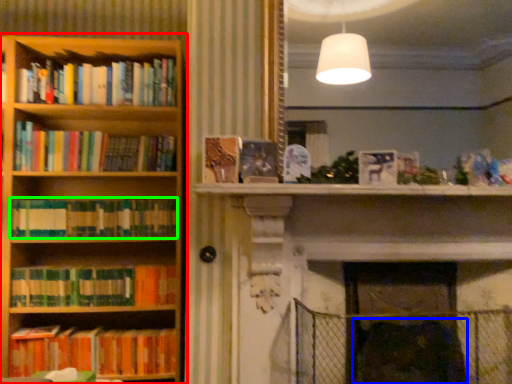
Question: Which is nearer to the bookcase (highlighted by a red box)? swivel chair (highlighted by a blue box) or book (highlighted by a green box).

Choices:
 (A) swivel chair
 (B) book

Answer: (B)